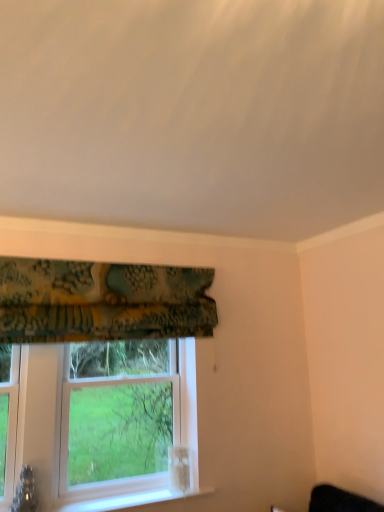
Question: Is white plastic window at center oriented towards textured green fabric at upper left?

Choices:
 (A) no
 (B) yes

Answer: (A)

Question: Can textured green fabric at upper left be found inside white plastic window at center?

Choices:
 (A) no
 (B) yes

Answer: (A)

Question: Would you consider white plastic window at center to be distant from textured green fabric at upper left?

Choices:
 (A) no
 (B) yes

Answer: (A)

Question: Are white plastic window at center and textured green fabric at upper left beside each other?

Choices:
 (A) yes
 (B) no

Answer: (B)

Question: Does white plastic window at center have a lesser height compared to textured green fabric at upper left?

Choices:
 (A) no
 (B) yes

Answer: (A)

Question: Is white plastic window at center thinner than textured green fabric at upper left?

Choices:
 (A) no
 (B) yes

Answer: (A)

Question: Considering the relative sizes of textured green fabric at upper left and white plastic window at center in the image provided, is textured green fabric at upper left smaller than white plastic window at center?

Choices:
 (A) no
 (B) yes

Answer: (B)

Question: Considering the relative positions of textured green fabric at upper left and white plastic window at center in the image provided, is textured green fabric at upper left to the right of white plastic window at center from the viewer's perspective?

Choices:
 (A) yes
 (B) no

Answer: (A)

Question: Is textured green fabric at upper left closer to camera compared to white plastic window at center?

Choices:
 (A) no
 (B) yes

Answer: (B)

Question: Considering the relative positions of textured green fabric at upper left and white plastic window at center in the image provided, is textured green fabric at upper left behind white plastic window at center?

Choices:
 (A) no
 (B) yes

Answer: (A)

Question: Does textured green fabric at upper left have a greater width compared to white plastic window at center?

Choices:
 (A) yes
 (B) no

Answer: (B)

Question: Is textured green fabric at upper left shorter than white plastic window at center?

Choices:
 (A) yes
 (B) no

Answer: (A)

Question: Does point (155, 398) appear closer or farther from the camera than point (157, 330)?

Choices:
 (A) farther
 (B) closer

Answer: (A)